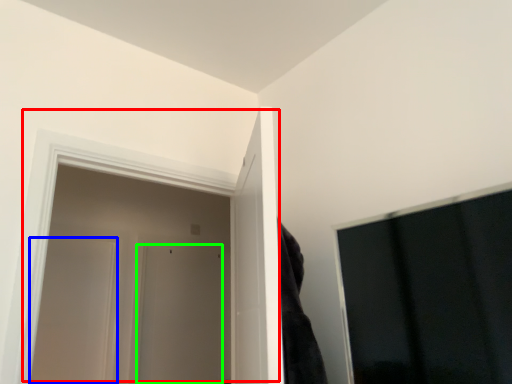
Question: Considering the real-world distances, which object is closest to door (highlighted by a red box)? door (highlighted by a blue box) or door (highlighted by a green box).

Choices:
 (A) door
 (B) door

Answer: (A)